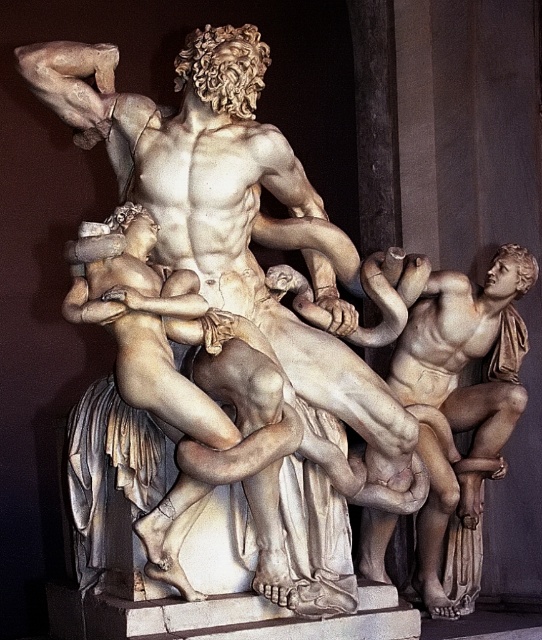
Question: Can you confirm if matte stone man at center is wider than matte bronze statue at right?

Choices:
 (A) yes
 (B) no

Answer: (A)

Question: Is white marble sculpture at center thinner than matte stone man at center?

Choices:
 (A) no
 (B) yes

Answer: (A)

Question: Which object is closer to the camera taking this photo?

Choices:
 (A) matte bronze statue at right
 (B) white marble sculpture at center
 (C) matte stone man at center

Answer: (C)

Question: Which object appears farthest from the camera in this image?

Choices:
 (A) white marble sculpture at center
 (B) matte bronze statue at right
 (C) matte stone man at center

Answer: (B)

Question: Which of the following is the farthest from the observer?

Choices:
 (A) matte bronze statue at right
 (B) matte stone man at center

Answer: (A)

Question: Is matte stone man at center smaller than matte bronze statue at right?

Choices:
 (A) yes
 (B) no

Answer: (B)